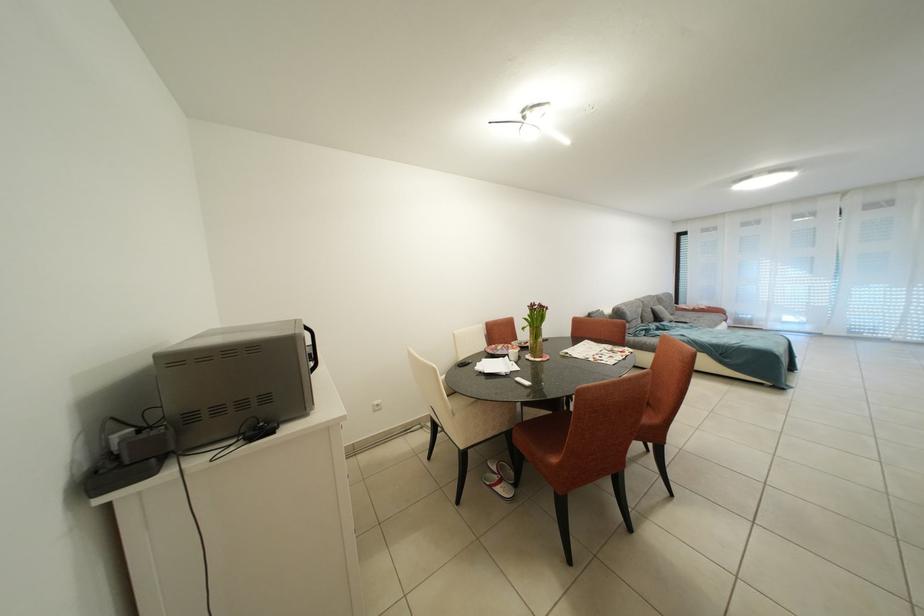
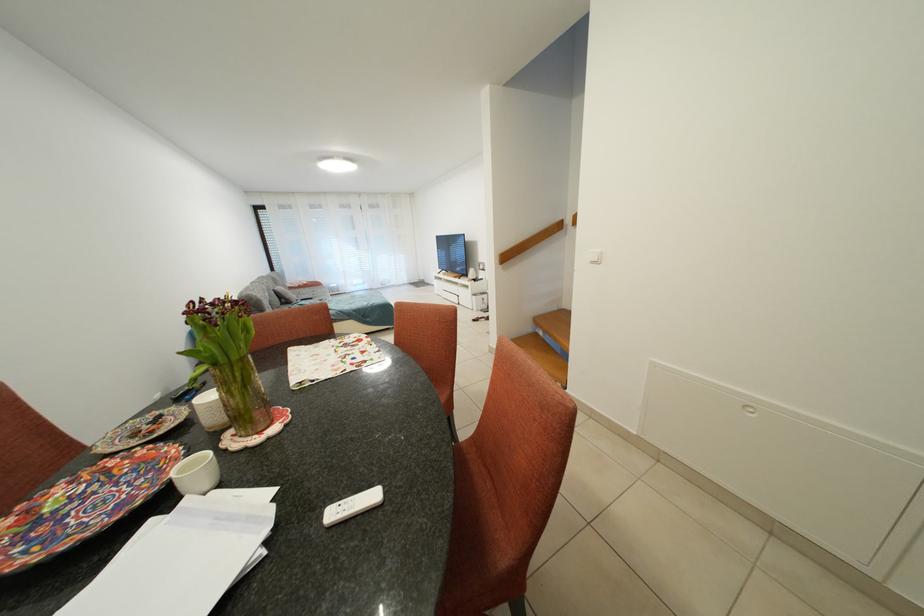
The point at (517, 350) is marked in the first image. Where is the corresponding point in the second image?

(120, 467)